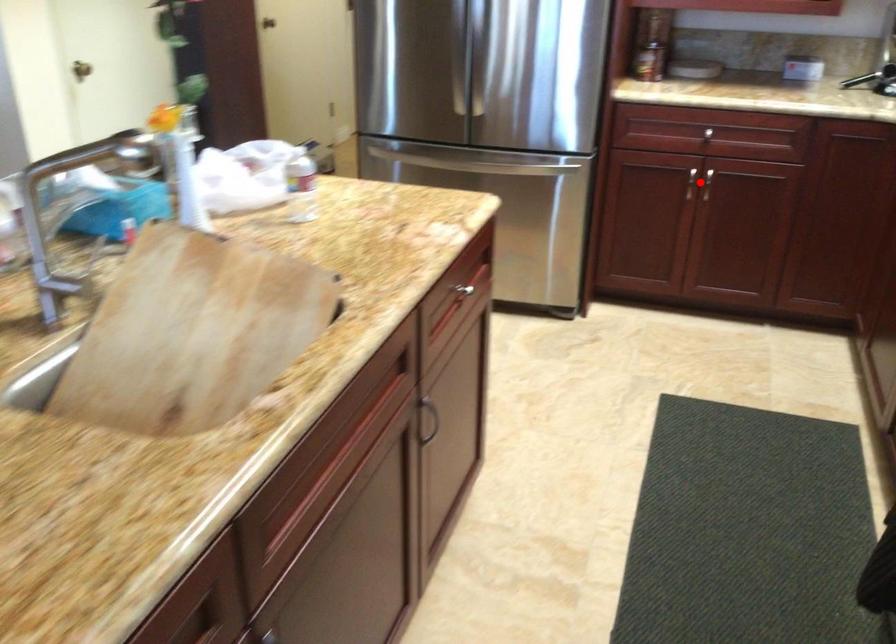
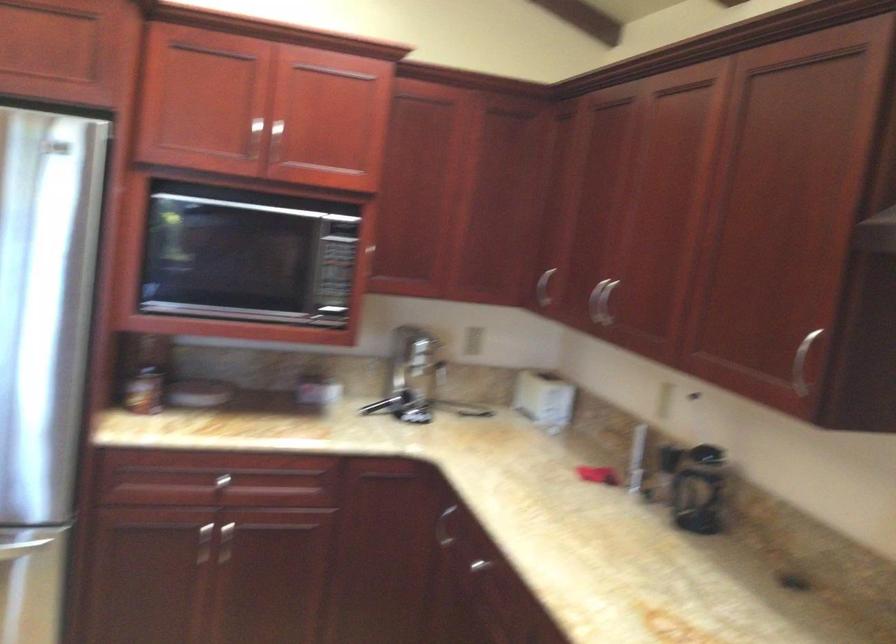
Find the pixel in the second image that matches the highlighted location in the first image.

(222, 543)